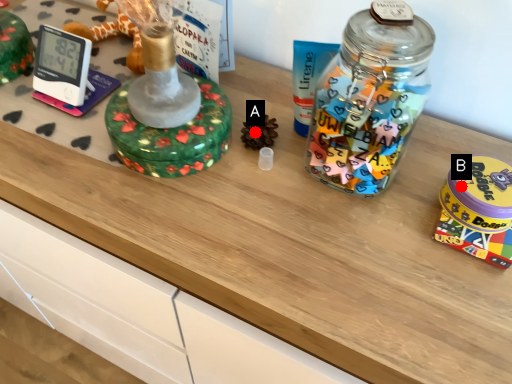
Question: Two points are circled on the image, labeled by A and B beside each circle. Which of the following is the farthest from the observer?

Choices:
 (A) A is further
 (B) B is further

Answer: (A)